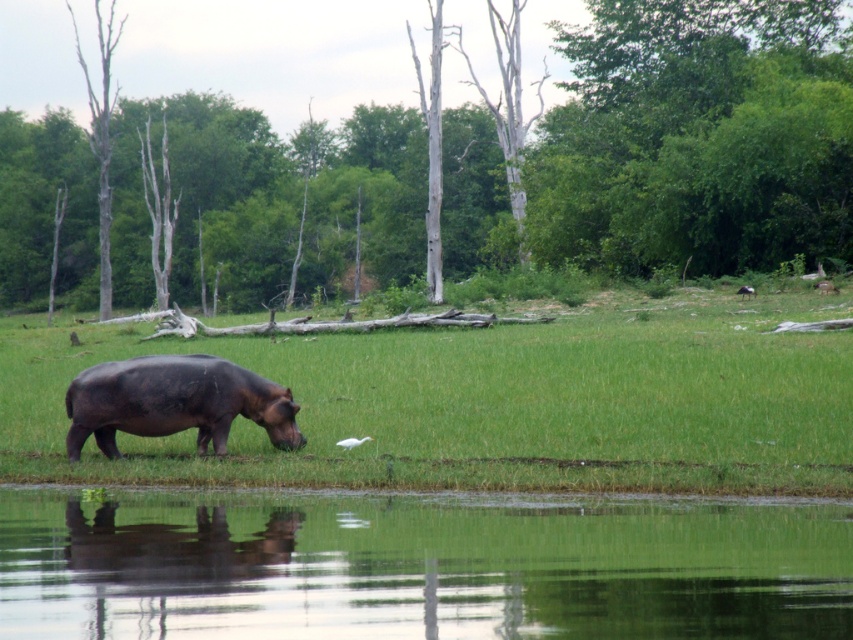
Question: Among these points, which one is nearest to the camera?

Choices:
 (A) (747, 285)
 (B) (76, 51)
 (C) (231, 410)

Answer: (C)

Question: Can you confirm if green grassy at lower center is positioned to the right of dark brown matte hippo at center?

Choices:
 (A) no
 (B) yes

Answer: (B)

Question: Is brown bark tree at center below bare wood tree at left?

Choices:
 (A) yes
 (B) no

Answer: (B)

Question: Which object appears farthest from the camera in this image?

Choices:
 (A) green reflective water at lower center
 (B) green grassy at lower center

Answer: (B)

Question: Which object is farther from the camera taking this photo?

Choices:
 (A) dark brown matte hippo at center
 (B) brown bark tree at center
 (C) white feathered bird at upper right

Answer: (B)

Question: From the image, what is the correct spatial relationship of dark brown matte hippo at center in relation to bare wood tree at left?

Choices:
 (A) right
 (B) left

Answer: (A)